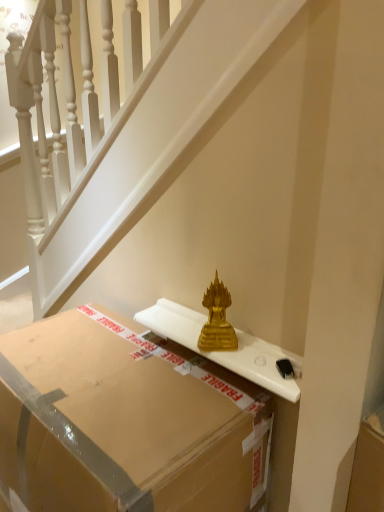
Question: Is matte cardboard box at center in front of or behind gold metallic statue at center in the image?

Choices:
 (A) behind
 (B) front

Answer: (B)

Question: Is matte cardboard box at center spatially inside gold metallic statue at center, or outside of it?

Choices:
 (A) inside
 (B) outside

Answer: (B)

Question: Which object is positioned farthest from the gold glass sculpture at center?

Choices:
 (A) matte cardboard box at center
 (B) gold metallic statue at center

Answer: (B)

Question: Which object is positioned closest to the matte cardboard box at center?

Choices:
 (A) gold metallic statue at center
 (B) gold glass sculpture at center

Answer: (B)